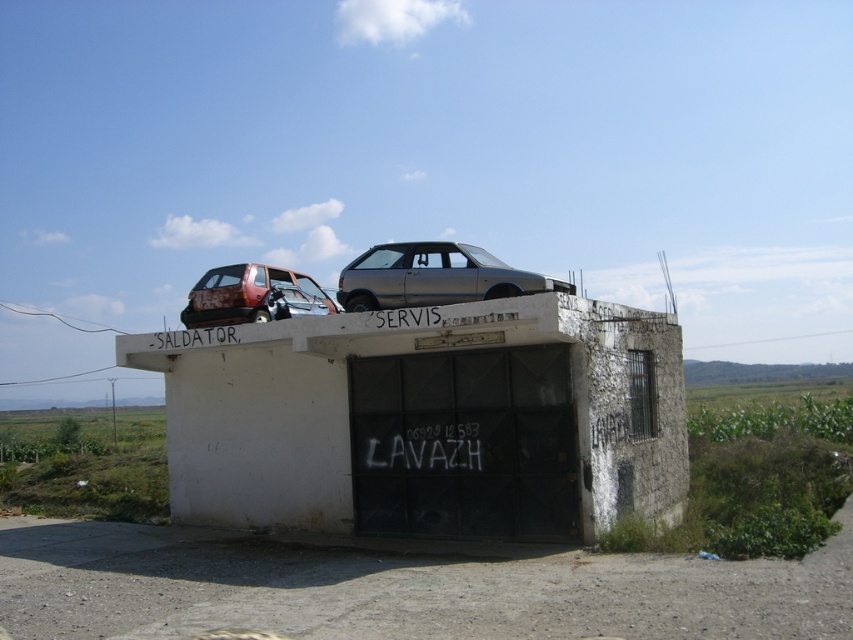
Question: Is metallic gray hatchback at center smaller than rusty metal hatchback at upper left?

Choices:
 (A) no
 (B) yes

Answer: (A)

Question: Which of the following is the farthest from the observer?

Choices:
 (A) (381, 244)
 (B) (482, 360)
 (C) (225, 296)

Answer: (A)

Question: Which of the following is the closest to the observer?

Choices:
 (A) white concrete bunker at center
 (B) rusty metal hatchback at upper left

Answer: (A)

Question: Is metallic gray hatchback at center above rusty metal hatchback at upper left?

Choices:
 (A) yes
 (B) no

Answer: (A)

Question: Observing the image, what is the correct spatial positioning of metallic gray hatchback at center in reference to rusty metal hatchback at upper left?

Choices:
 (A) above
 (B) below

Answer: (A)

Question: Which of the following is the closest to the observer?

Choices:
 (A) metallic gray hatchback at center
 (B) white concrete bunker at center
 (C) rusty metal hatchback at upper left

Answer: (A)